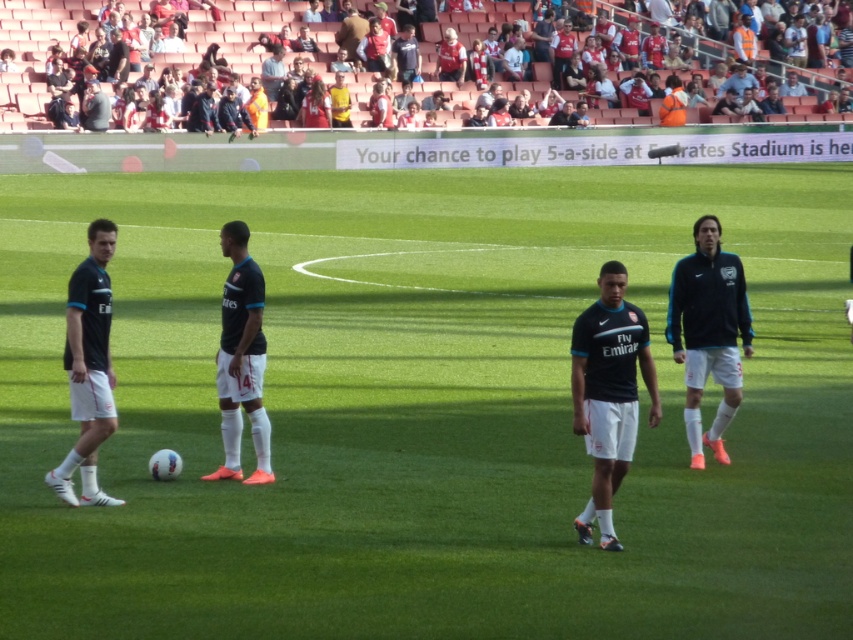
Question: Estimate the real-world distances between objects in this image. Which object is closer to the matte black jersey at center?

Choices:
 (A) black matte jacket at right
 (B) black jersey at upper center

Answer: (A)

Question: Among these objects, which one is farthest from the camera?

Choices:
 (A) matte black jersey at center
 (B) black matte jersey at left
 (C) black matte jacket at right
 (D) black jersey at upper center

Answer: (D)

Question: Considering the relative positions of black jersey at upper center and black matte jersey at left in the image provided, where is black jersey at upper center located with respect to black matte jersey at left?

Choices:
 (A) below
 (B) above

Answer: (B)

Question: Is black jersey at upper center to the left of black matte jersey at left from the viewer's perspective?

Choices:
 (A) no
 (B) yes

Answer: (A)

Question: Considering the real-world distances, which object is closest to the dark gray jacket at upper left?

Choices:
 (A) black matte jersey at center
 (B) black jersey at upper center
 (C) black matte jacket at right

Answer: (B)

Question: Considering the relative positions of black matte jacket at right and black matte jersey at center in the image provided, where is black matte jacket at right located with respect to black matte jersey at center?

Choices:
 (A) above
 (B) below

Answer: (A)